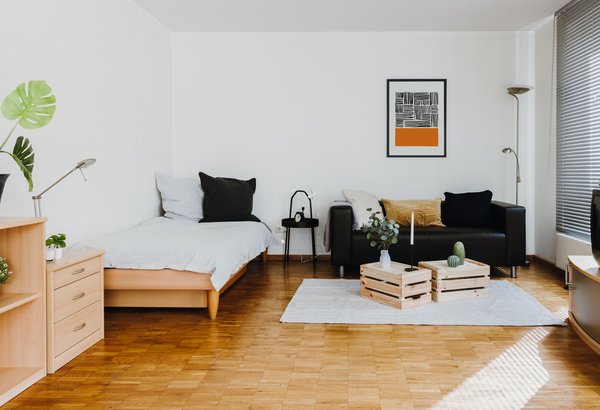
You are a GUI agent. You are given a task and a screenshot of the screen. Output one action in this format:
    pyautogui.click(x=<x>, y=<y>)
    Task: Click on the tv stand
    Image resolution: width=600 pixels, height=410 pixels.
    Given the screenshot: What is the action you would take?
    pyautogui.click(x=584, y=290)